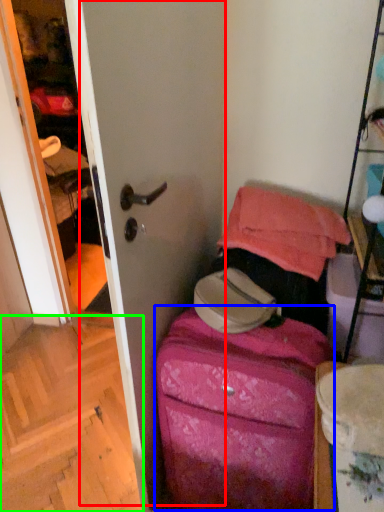
Question: Estimate the real-world distances between objects in this image. Which object is farther from screen door (highlighted by a red box), luggage (highlighted by a blue box) or stairwell (highlighted by a green box)?

Choices:
 (A) luggage
 (B) stairwell

Answer: (B)